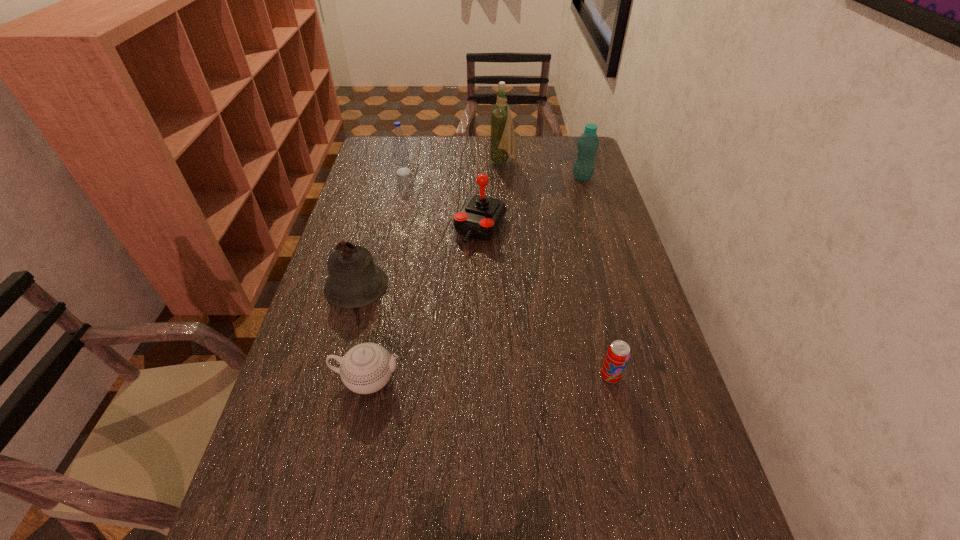
I want to click on water bottle that is at the left edge, so click(401, 154).

The width and height of the screenshot is (960, 540). Identify the location of bell located in the left edge section of the desktop. (355, 281).

Locate an element on the screen. This screenshot has width=960, height=540. chinaware at the left edge is located at coordinates (366, 368).

Where is `water bottle that is at the right edge`? This screenshot has width=960, height=540. water bottle that is at the right edge is located at coordinates (588, 143).

Find the location of a particular element. This screenshot has width=960, height=540. soda can that is at the right edge is located at coordinates (618, 353).

Identify the location of object that is at the far left corner. This screenshot has height=540, width=960. point(401,154).

The image size is (960, 540). I want to click on free space at the far edge, so click(x=410, y=150).

Where is `vacant region at the left edge of the desktop`? vacant region at the left edge of the desktop is located at coordinates (261, 447).

In the image, there is a desktop. Where is `free region at the far left corner`? free region at the far left corner is located at coordinates (391, 144).

This screenshot has height=540, width=960. I want to click on free spot between the soda can and the chinaware, so click(x=490, y=377).